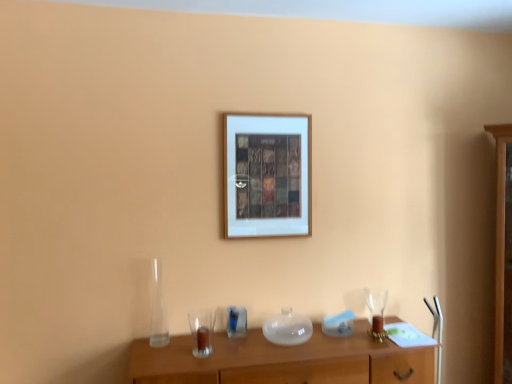
Question: Considering the relative sizes of transparent glass vase at lower left and white matte picture frame at center in the image provided, is transparent glass vase at lower left taller than white matte picture frame at center?

Choices:
 (A) yes
 (B) no

Answer: (B)

Question: Can you confirm if transparent glass vase at lower left is smaller than white matte picture frame at center?

Choices:
 (A) yes
 (B) no

Answer: (A)

Question: Would you say transparent glass vase at lower left is a long distance from white matte picture frame at center?

Choices:
 (A) no
 (B) yes

Answer: (A)

Question: Is transparent glass vase at lower left not within white matte picture frame at center?

Choices:
 (A) yes
 (B) no

Answer: (A)

Question: From the image's perspective, is transparent glass vase at lower left under white matte picture frame at center?

Choices:
 (A) no
 (B) yes

Answer: (B)

Question: Can you confirm if transparent glass vase at lower left is bigger than white matte picture frame at center?

Choices:
 (A) yes
 (B) no

Answer: (B)

Question: Can you confirm if white matte picture frame at center is bigger than wooden table at center?

Choices:
 (A) yes
 (B) no

Answer: (B)

Question: Is wooden table at center surrounded by white matte picture frame at center?

Choices:
 (A) no
 (B) yes

Answer: (A)

Question: From the image's perspective, is white matte picture frame at center over wooden table at center?

Choices:
 (A) yes
 (B) no

Answer: (A)

Question: Is the depth of white matte picture frame at center greater than that of wooden table at center?

Choices:
 (A) yes
 (B) no

Answer: (A)

Question: Is white matte picture frame at center oriented away from wooden table at center?

Choices:
 (A) yes
 (B) no

Answer: (B)

Question: From a real-world perspective, is white matte picture frame at center over wooden table at center?

Choices:
 (A) yes
 (B) no

Answer: (A)

Question: Can you see white matte picture frame at center touching clear glass wine glass at right?

Choices:
 (A) no
 (B) yes

Answer: (A)